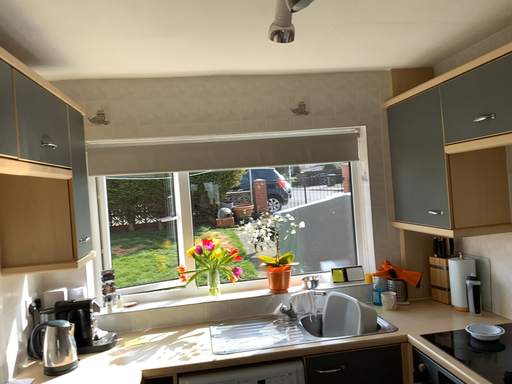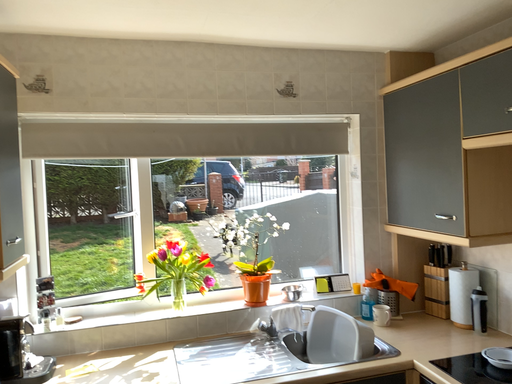
Question: How did the camera likely rotate when shooting the video?

Choices:
 (A) rotated right
 (B) rotated left

Answer: (A)